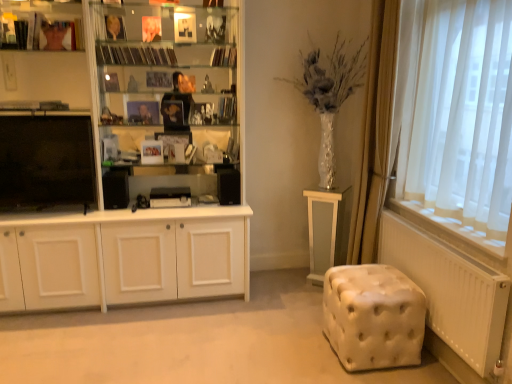
Question: Is white tufted ottoman at lower right further to camera compared to white glossy cupboard at left?

Choices:
 (A) no
 (B) yes

Answer: (A)

Question: From a real-world perspective, is white tufted ottoman at lower right located higher than white glossy cupboard at left?

Choices:
 (A) no
 (B) yes

Answer: (A)

Question: Is white tufted ottoman at lower right located outside white glossy cupboard at left?

Choices:
 (A) no
 (B) yes

Answer: (B)

Question: From a real-world perspective, is white tufted ottoman at lower right beneath white glossy cupboard at left?

Choices:
 (A) yes
 (B) no

Answer: (A)

Question: Can you confirm if white tufted ottoman at lower right is positioned to the left of white glossy cupboard at left?

Choices:
 (A) no
 (B) yes

Answer: (A)

Question: From a real-world perspective, is gold metallic book at upper center, marked as the 1th book in a left-to-right arrangement, positioned above or below white glossy cupboard at left?

Choices:
 (A) above
 (B) below

Answer: (A)

Question: In terms of size, does gold metallic book at upper center, marked as the 1th book in a left-to-right arrangement, appear bigger or smaller than white glossy cupboard at left?

Choices:
 (A) big
 (B) small

Answer: (B)

Question: Is gold metallic book at upper center, the 4th book viewed from the right, in front of or behind white glossy cupboard at left in the image?

Choices:
 (A) behind
 (B) front

Answer: (A)

Question: In terms of width, does gold metallic book at upper center, marked as the 1th book in a left-to-right arrangement, look wider or thinner when compared to white glossy cupboard at left?

Choices:
 (A) thin
 (B) wide

Answer: (A)

Question: Considering their positions, is black matte bookshelf at upper center, the third book when ordered from right to left, located in front of or behind hardcover book at upper center, placed as the 2th book when sorted from right to left?

Choices:
 (A) behind
 (B) front

Answer: (B)

Question: Which is correct: black matte bookshelf at upper center, the third book when ordered from right to left, is inside hardcover book at upper center, placed as the 2th book when sorted from right to left, or outside of it?

Choices:
 (A) inside
 (B) outside

Answer: (B)

Question: From a real-world perspective, relative to hardcover book at upper center, placed as the 2th book when sorted from right to left, is black matte bookshelf at upper center, the second book from the left, vertically above or below?

Choices:
 (A) above
 (B) below

Answer: (A)

Question: Would you say black matte bookshelf at upper center, the second book from the left, is to the left or to the right of hardcover book at upper center, placed as the 2th book when sorted from right to left, in the picture?

Choices:
 (A) left
 (B) right

Answer: (A)

Question: In terms of size, does white glossy table at lower right appear bigger or smaller than black matte bookshelf at upper center, the third book when ordered from right to left?

Choices:
 (A) big
 (B) small

Answer: (A)

Question: Does point (320, 271) appear closer or farther from the camera than point (97, 51)?

Choices:
 (A) closer
 (B) farther

Answer: (B)